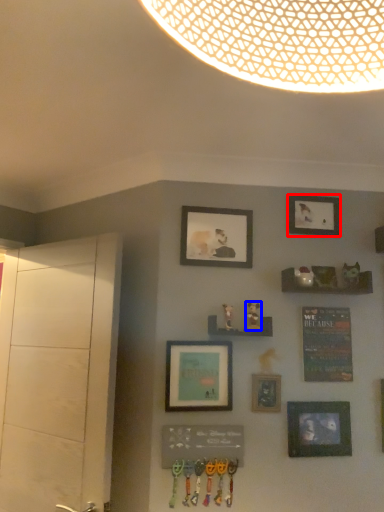
Question: Among these objects, which one is farthest to the camera, picture frame (highlighted by a red box) or art (highlighted by a blue box)?

Choices:
 (A) picture frame
 (B) art

Answer: (A)